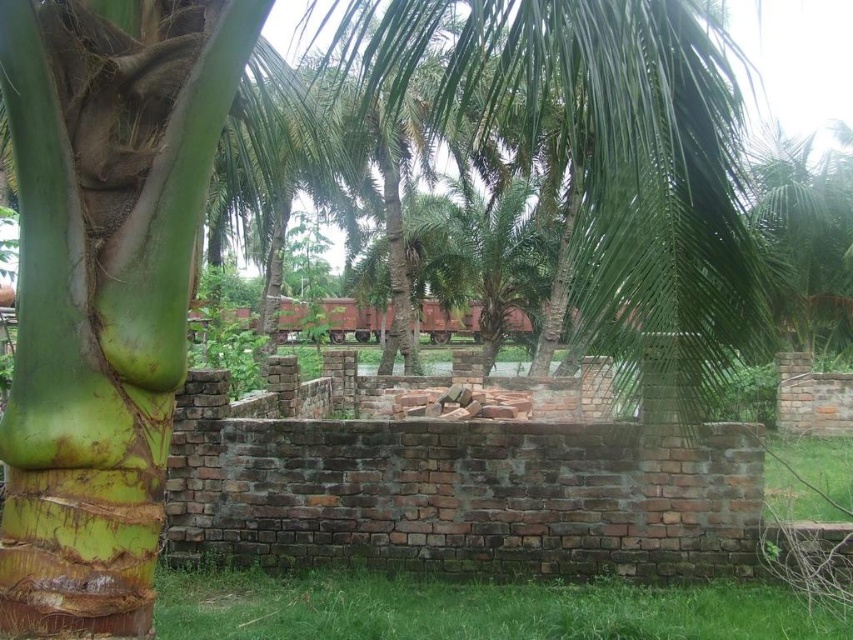
In the scene shown: You are standing in the tropical setting and want to take a photo of the green grass at lower center and the green leafy palm tree at center. Which object should you focus on first if you want to capture both in a single frame without moving the camera?

You should focus on the green leafy palm tree at center first because it is above the green grass at lower center, so adjusting the focus to the tree will ensure the grass is also in the frame as it is lower down.